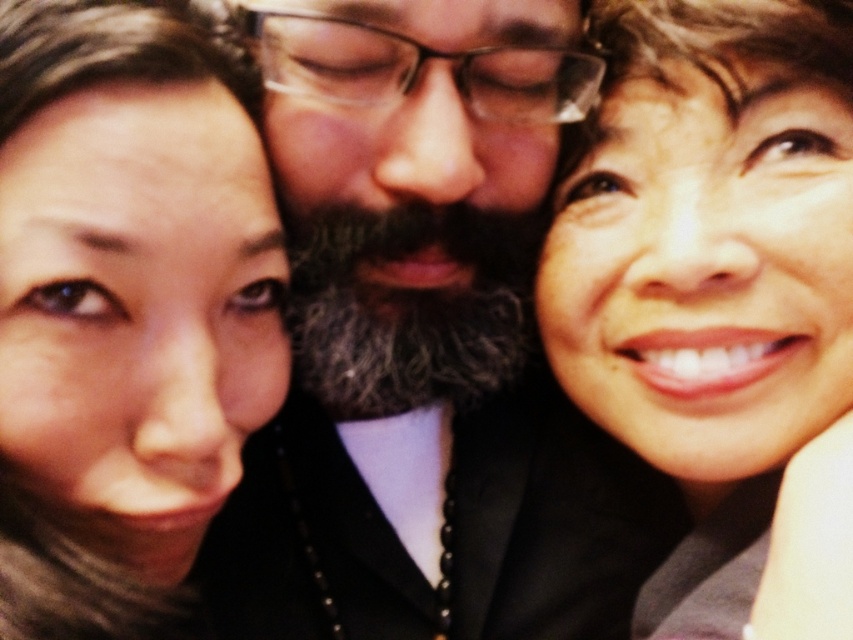
Question: Does gray beard at center have a smaller size compared to smooth skin face at upper right?

Choices:
 (A) no
 (B) yes

Answer: (A)

Question: Which point is farther to the camera?

Choices:
 (A) (561, 104)
 (B) (596, 252)
 (C) (165, 384)

Answer: (B)

Question: Is gray beard at center wider than smooth skin face at upper right?

Choices:
 (A) yes
 (B) no

Answer: (A)

Question: Among these points, which one is farthest from the camera?

Choices:
 (A) (148, 32)
 (B) (421, 80)
 (C) (799, 234)

Answer: (C)

Question: Can you confirm if gray beard at center is wider than smooth skin face at upper right?

Choices:
 (A) no
 (B) yes

Answer: (B)

Question: Which point is closer to the camera taking this photo?

Choices:
 (A) (700, 42)
 (B) (260, 509)

Answer: (A)